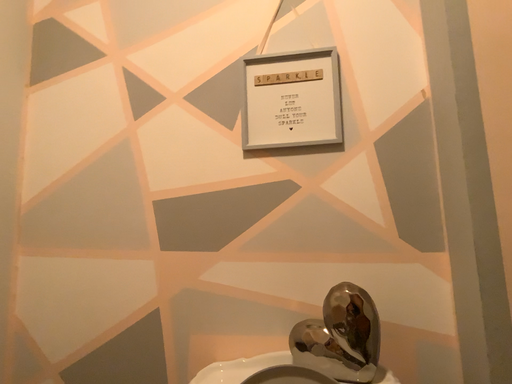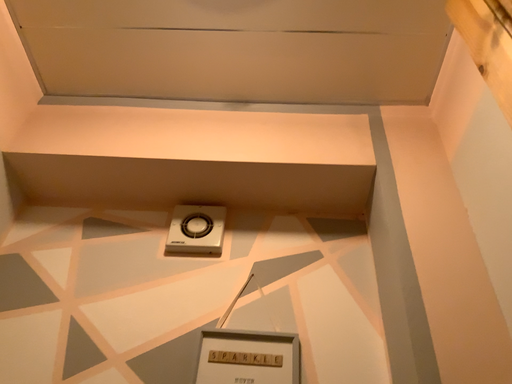
Question: Which way did the camera rotate in the video?

Choices:
 (A) rotated right
 (B) rotated left

Answer: (A)